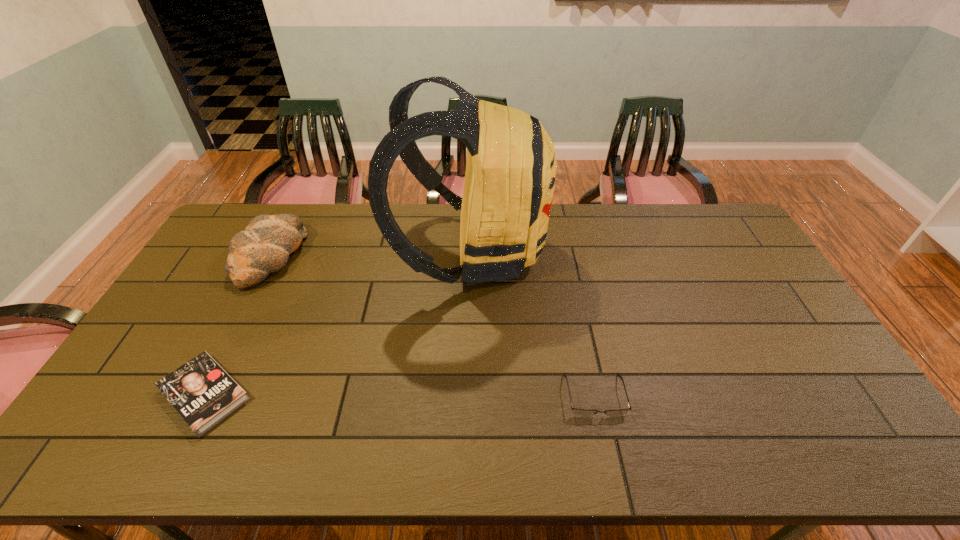
Where is `backpack`? backpack is located at coordinates (511, 166).

Locate an element on the screen. The height and width of the screenshot is (540, 960). the third shortest object is located at coordinates (264, 247).

Where is `spectacles`? The image size is (960, 540). spectacles is located at coordinates (576, 412).

Where is `the shortest object`? This screenshot has width=960, height=540. the shortest object is located at coordinates (201, 391).

Locate an element on the screen. The width and height of the screenshot is (960, 540). vacant region located on the front-facing side of the tallest object is located at coordinates (609, 252).

You are a GUI agent. You are given a task and a screenshot of the screen. Output one action in this format:
    pyautogui.click(x=<x>, y=<y>)
    Task: Click on the free space located on the right of the bread
    The image size is (960, 540).
    Given the screenshot: What is the action you would take?
    pyautogui.click(x=376, y=256)

Image resolution: width=960 pixels, height=540 pixels. I want to click on vacant space located 0.060m on the front-facing side of the spectacles, so click(605, 442).

The width and height of the screenshot is (960, 540). Identify the location of free space located on the right of the book. (375, 394).

Where is `backpack that is positioned at the far edge`? Image resolution: width=960 pixels, height=540 pixels. backpack that is positioned at the far edge is located at coordinates (511, 166).

Locate an element on the screen. The height and width of the screenshot is (540, 960). bread that is positioned at the far edge is located at coordinates (264, 247).